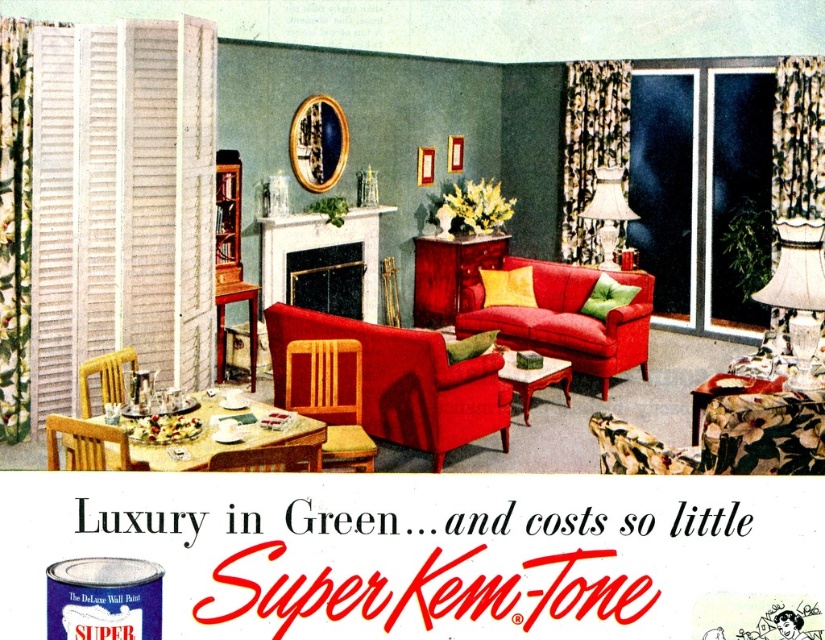
Question: Is wooden chair at center behind white fabric lampshade at center-right?

Choices:
 (A) yes
 (B) no

Answer: (B)

Question: Which point appears closest to the camera in this image?

Choices:
 (A) (102, 420)
 (B) (508, 353)

Answer: (A)

Question: Which of the following is the closest to the observer?

Choices:
 (A) (628, 218)
 (B) (359, 333)

Answer: (B)

Question: From the image, what is the correct spatial relationship of white marble fireplace at center in relation to matte wood coffee table at center?

Choices:
 (A) left
 (B) right

Answer: (A)

Question: Among these objects, which one is farthest from the camera?

Choices:
 (A) white textured lampshade at upper right
 (B) wooden chair at center
 (C) white marble fireplace at center
 (D) white fabric lampshade at center-right

Answer: (D)

Question: Can you confirm if velvet red couch at center is positioned below rattan chair at lower left?

Choices:
 (A) no
 (B) yes

Answer: (B)